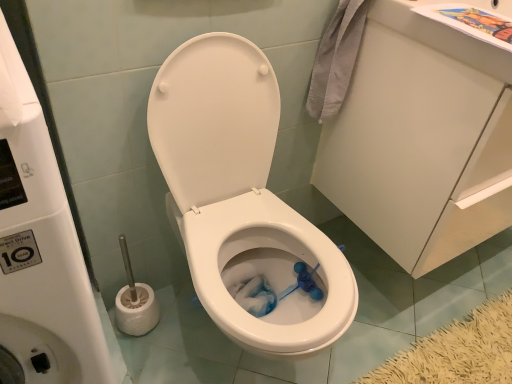
Question: Is white glossy cabinet at upper right facing away from white glossy water tank at upper center?

Choices:
 (A) yes
 (B) no

Answer: (B)

Question: Is white glossy water tank at upper center surrounded by white glossy cabinet at upper right?

Choices:
 (A) yes
 (B) no

Answer: (B)

Question: Is white glossy cabinet at upper right at the right side of white glossy water tank at upper center?

Choices:
 (A) yes
 (B) no

Answer: (A)

Question: Is the position of white glossy cabinet at upper right less distant than that of white glossy water tank at upper center?

Choices:
 (A) no
 (B) yes

Answer: (A)

Question: Is white glossy cabinet at upper right taller than white glossy water tank at upper center?

Choices:
 (A) no
 (B) yes

Answer: (A)

Question: Does white glossy cabinet at upper right appear on the left side of white glossy water tank at upper center?

Choices:
 (A) no
 (B) yes

Answer: (A)

Question: Can you confirm if white glossy cabinet at upper right is positioned to the right of white glossy toilet at center?

Choices:
 (A) no
 (B) yes

Answer: (B)

Question: Is white glossy cabinet at upper right positioned in front of white glossy toilet at center?

Choices:
 (A) no
 (B) yes

Answer: (A)

Question: Is the depth of white glossy cabinet at upper right greater than that of white glossy toilet at center?

Choices:
 (A) no
 (B) yes

Answer: (B)

Question: Is white glossy cabinet at upper right beside white glossy toilet at center?

Choices:
 (A) yes
 (B) no

Answer: (B)

Question: From a real-world perspective, does white glossy cabinet at upper right sit lower than white glossy toilet at center?

Choices:
 (A) yes
 (B) no

Answer: (B)

Question: From a real-world perspective, does white glossy cabinet at upper right stand above white glossy toilet at center?

Choices:
 (A) yes
 (B) no

Answer: (A)

Question: Considering the relative positions of white glossy toilet at center and white glossy water tank at upper center in the image provided, is white glossy toilet at center to the left of white glossy water tank at upper center from the viewer's perspective?

Choices:
 (A) yes
 (B) no

Answer: (B)